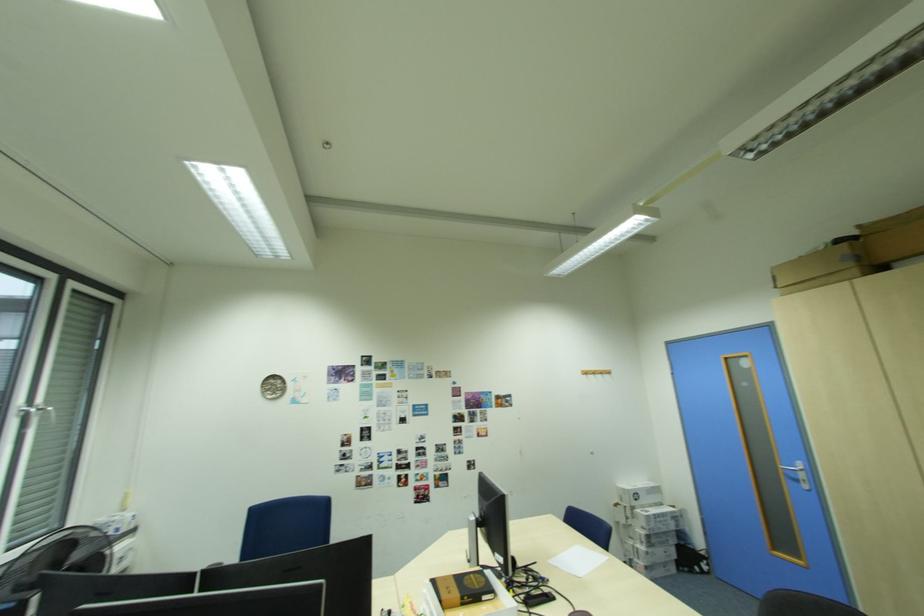
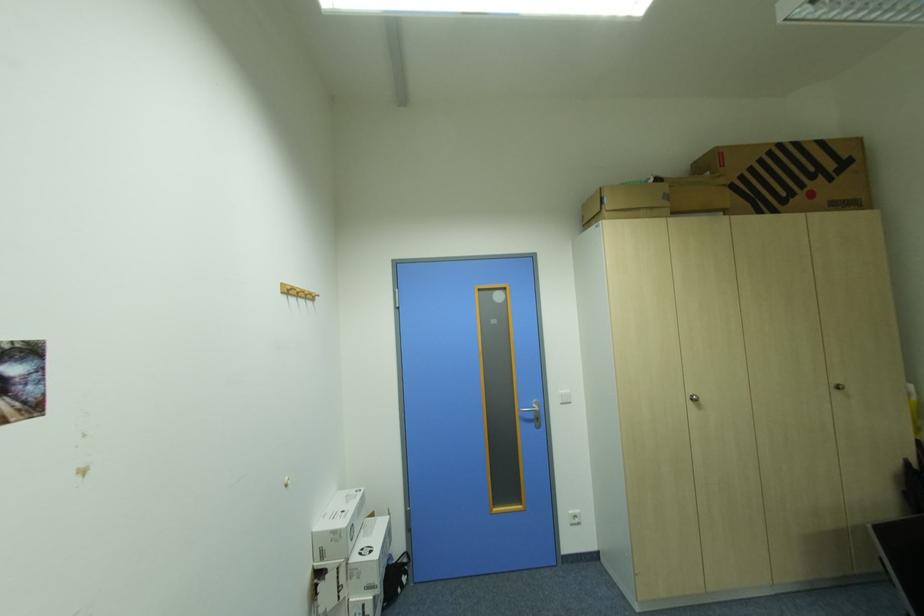
Where in the second image is the point corresponding to [650,528] from the first image?

(377, 590)